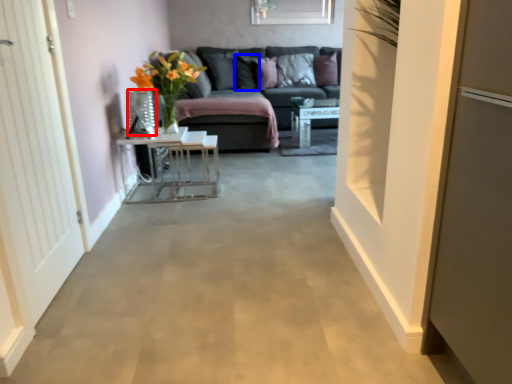
Question: Which of the following is the farthest to the observer, glass vase (highlighted by a red box) or pillow (highlighted by a blue box)?

Choices:
 (A) glass vase
 (B) pillow

Answer: (B)